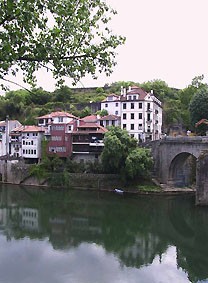
Where is `archway`? The height and width of the screenshot is (283, 208). archway is located at coordinates (185, 174).